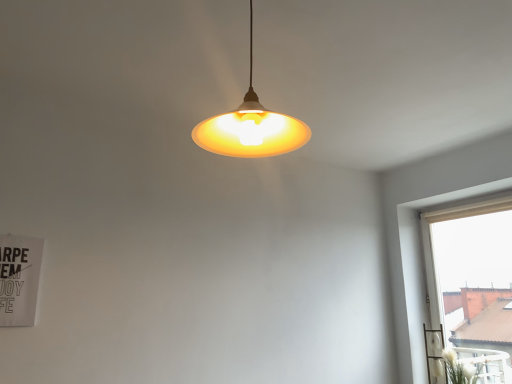
Question: From a real-world perspective, is white fluffy plant at lower right positioned above or below beige fabric curtain at right?

Choices:
 (A) below
 (B) above

Answer: (A)

Question: Is white fluffy plant at lower right wider or thinner than beige fabric curtain at right?

Choices:
 (A) wide
 (B) thin

Answer: (A)

Question: Estimate the real-world distances between objects in this image. Which object is closer to the white fluffy plant at lower right?

Choices:
 (A) matte yellow plastic lampshade at center
 (B) beige fabric curtain at right

Answer: (B)

Question: Which object is positioned closest to the white fluffy plant at lower right?

Choices:
 (A) matte yellow plastic lampshade at center
 (B) beige fabric curtain at right

Answer: (B)